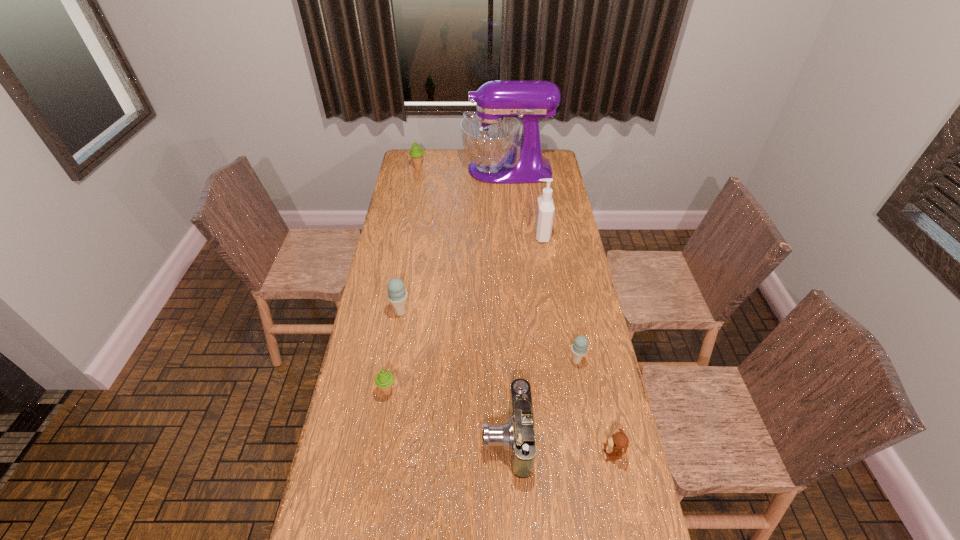
Where is `blank region between the mixer and the nearer green icecream`? blank region between the mixer and the nearer green icecream is located at coordinates (447, 280).

Choose which object is the second nearest neighbor to the shortest object. Please provide its 2D coordinates. Your answer should be formatted as a tuple, i.e. [(x, y)], where the tuple contains the x and y coordinates of a point satisfying the conditions above.

[(579, 348)]

Locate an element on the screen. object that stands as the sixth closest to the third farthest ice cream is located at coordinates (490, 136).

Locate which ice cream is the fourth closest to the seventh shortest object. Please provide its 2D coordinates. Your answer should be formatted as a tuple, i.e. [(x, y)], where the tuple contains the x and y coordinates of a point satisfying the conditions above.

[(384, 379)]

Identify the location of ice cream that stands as the second closest to the left blue ice cream. Image resolution: width=960 pixels, height=540 pixels. [x=579, y=348].

Where is `free point that satisfies the following two spatial constraints: 1. on the back side of the fourth nearest object; 2. on the front label of the cleansing agent`? The height and width of the screenshot is (540, 960). free point that satisfies the following two spatial constraints: 1. on the back side of the fourth nearest object; 2. on the front label of the cleansing agent is located at coordinates (553, 235).

I want to click on free point that satisfies the following two spatial constraints: 1. on the front side of the fourth farthest object; 2. on the left side of the fourth nearest object, so click(393, 361).

This screenshot has height=540, width=960. Identify the location of vacant space that satisfies the following two spatial constraints: 1. at the bowl opening of the mixer; 2. on the left side of the second nearest ice cream. (522, 361).

Find the location of a particular element. vacant point that satisfies the following two spatial constraints: 1. on the front label of the third farthest object; 2. on the front side of the smaller green icecream is located at coordinates [565, 391].